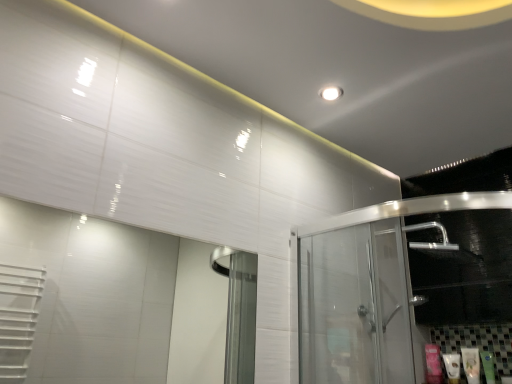
Question: Can you confirm if white glossy lotion at lower right, which is counted as the third toiletry, starting from the left, is positioned to the left of pink matte tube at lower right, the fourth toiletry viewed from the right?

Choices:
 (A) no
 (B) yes

Answer: (A)

Question: Considering the relative sizes of white glossy lotion at lower right, which ranks as the 2th toiletry in right-to-left order, and pink matte tube at lower right, the fourth toiletry viewed from the right, in the image provided, is white glossy lotion at lower right, which ranks as the 2th toiletry in right-to-left order, thinner than pink matte tube at lower right, the fourth toiletry viewed from the right,?

Choices:
 (A) yes
 (B) no

Answer: (B)

Question: Is white glossy lotion at lower right, which ranks as the 2th toiletry in right-to-left order, not within pink matte tube at lower right, acting as the first toiletry starting from the left?

Choices:
 (A) no
 (B) yes

Answer: (B)

Question: Is white glossy lotion at lower right, which ranks as the 2th toiletry in right-to-left order, placed right next to pink matte tube at lower right, the fourth toiletry viewed from the right?

Choices:
 (A) no
 (B) yes

Answer: (A)

Question: Is white glossy lotion at lower right, which ranks as the 2th toiletry in right-to-left order, shorter than pink matte tube at lower right, the fourth toiletry viewed from the right?

Choices:
 (A) yes
 (B) no

Answer: (A)

Question: Considering the relative sizes of white glossy lotion at lower right, which ranks as the 2th toiletry in right-to-left order, and pink matte tube at lower right, the fourth toiletry viewed from the right, in the image provided, is white glossy lotion at lower right, which ranks as the 2th toiletry in right-to-left order, wider than pink matte tube at lower right, the fourth toiletry viewed from the right,?

Choices:
 (A) no
 (B) yes

Answer: (B)

Question: Can you confirm if transparent glass door at right is bigger than pink matte tube at lower right, acting as the first toiletry starting from the left?

Choices:
 (A) no
 (B) yes

Answer: (B)

Question: Is transparent glass door at right placed right next to pink matte tube at lower right, the fourth toiletry viewed from the right?

Choices:
 (A) no
 (B) yes

Answer: (A)

Question: Does transparent glass door at right have a lesser width compared to pink matte tube at lower right, the fourth toiletry viewed from the right?

Choices:
 (A) yes
 (B) no

Answer: (B)

Question: From the image's perspective, is transparent glass door at right located above pink matte tube at lower right, acting as the first toiletry starting from the left?

Choices:
 (A) yes
 (B) no

Answer: (A)

Question: Is transparent glass door at right taller than pink matte tube at lower right, the fourth toiletry viewed from the right?

Choices:
 (A) yes
 (B) no

Answer: (A)

Question: From a real-world perspective, is transparent glass door at right under pink matte tube at lower right, acting as the first toiletry starting from the left?

Choices:
 (A) no
 (B) yes

Answer: (A)

Question: Is white glossy lotion at lower right, which ranks as the 2th toiletry in left-to-right order, next to transparent glass door at right and touching it?

Choices:
 (A) yes
 (B) no

Answer: (B)